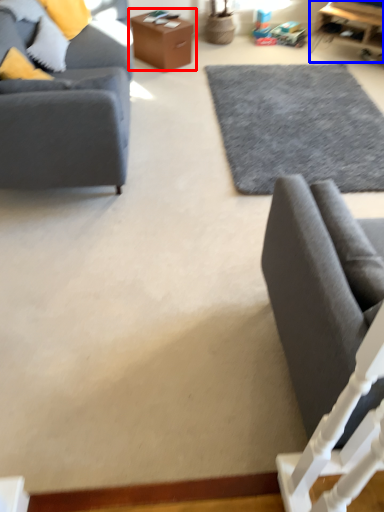
Question: Which point is further to the camera, table (highlighted by a red box) or table (highlighted by a blue box)?

Choices:
 (A) table
 (B) table

Answer: (B)